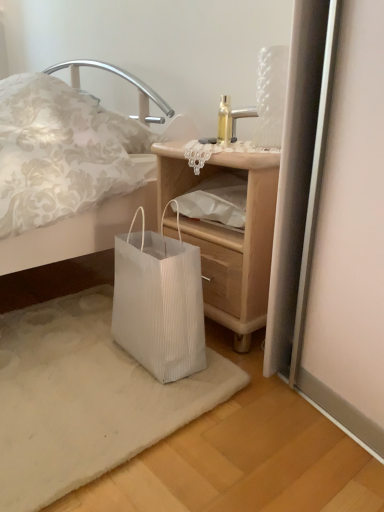
Find the location of a particular element. vacant region under white pleated paper bag at lower left (from a real-world perspective) is located at coordinates (75, 392).